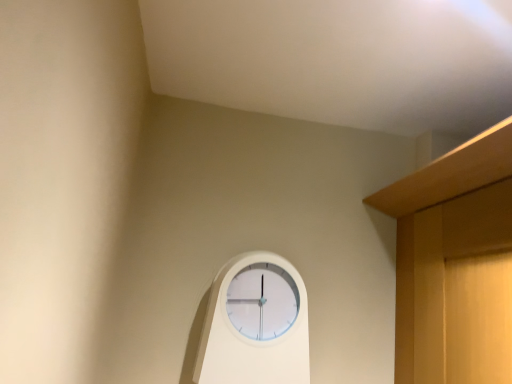
Find the location of a particular element. This screenshot has height=384, width=512. white plastic wall clock at upper center is located at coordinates (255, 324).

This screenshot has width=512, height=384. What do you see at coordinates (255, 324) in the screenshot?
I see `white plastic wall clock at upper center` at bounding box center [255, 324].

What is the approximate width of white plastic wall clock at upper center?

8.53 centimeters.

In order to click on white plastic wall clock at upper center in this screenshot , I will do `click(255, 324)`.